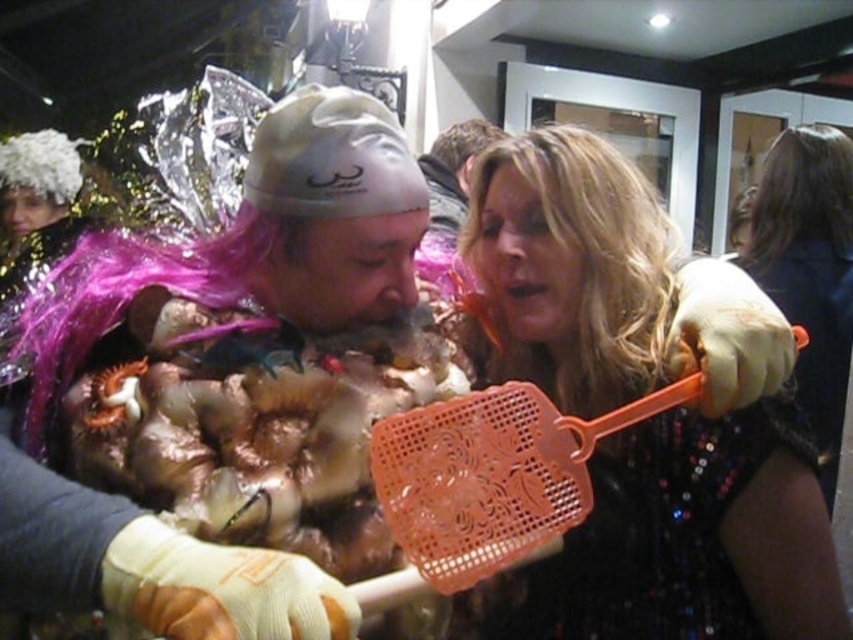
You are a photographer at the event and want to capture both the shiny metallic costume at center and the brown synthetic wig at upper right in a single frame. Based on their sizes, will you need to adjust your camera angle to ensure both are fully visible?

The shiny metallic costume at center might be wider than brown synthetic wig at upper right, so you may need to adjust your camera angle to ensure both are fully visible.

You are a photographer at the party and need to capture a photo that includes both the shiny metallic costume at center and the brown synthetic wig at upper right. Based on their positions, which object should be placed closer to the left side of the photo frame?

The shiny metallic costume at center should be placed closer to the left side of the photo frame because it is positioned on the left side of the brown synthetic wig at upper right.